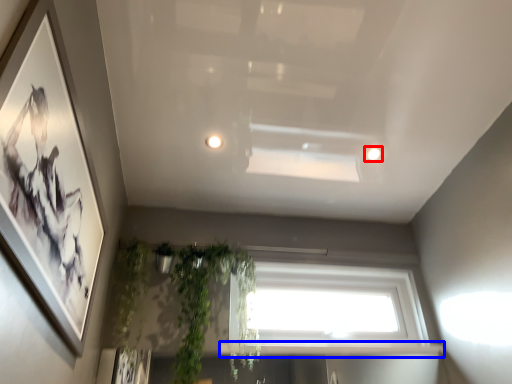
Question: Which of the following is the closest to the observer, lighting (highlighted by a red box) or window sill (highlighted by a blue box)?

Choices:
 (A) lighting
 (B) window sill

Answer: (B)